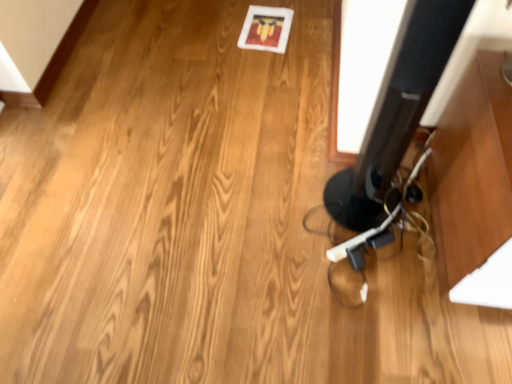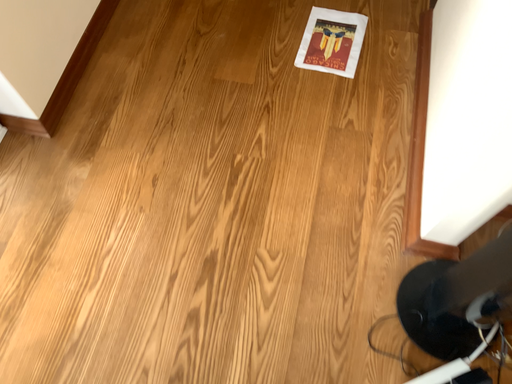
Question: How did the camera likely rotate when shooting the video?

Choices:
 (A) rotated upward
 (B) rotated downward

Answer: (B)